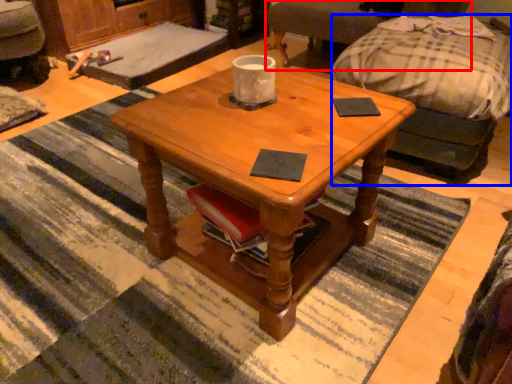
Question: Which of the following is the farthest to the observer, swivel chair (highlighted by a red box) or studio couch (highlighted by a blue box)?

Choices:
 (A) swivel chair
 (B) studio couch

Answer: (A)